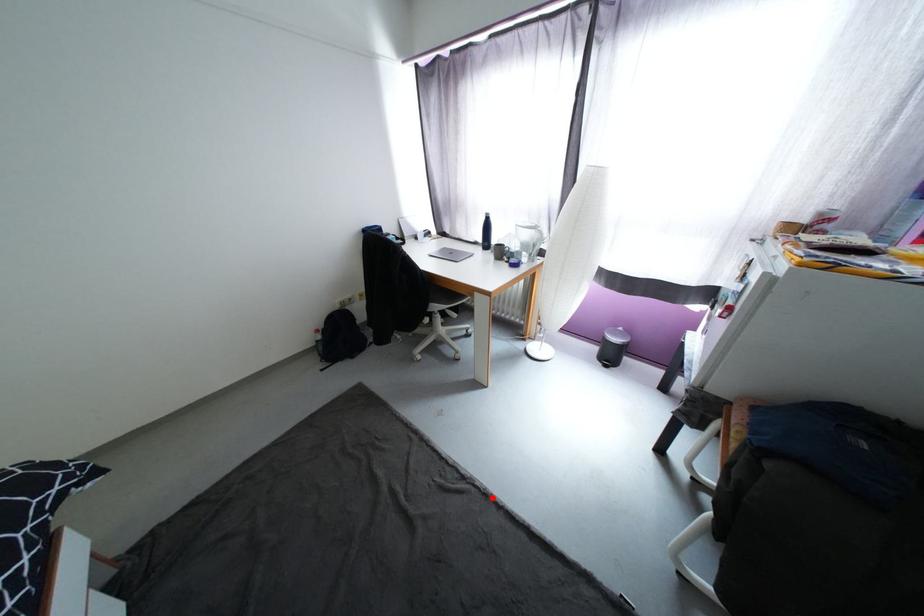
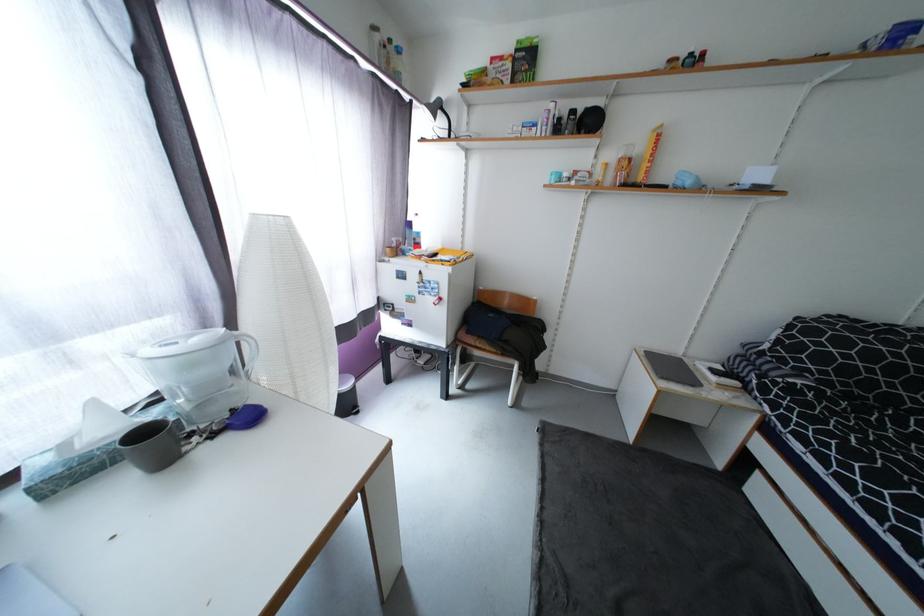
Question: I am providing you with two images of the same scene from different viewpoints. Image1 has a red point marked. In image2, the corresponding 3D location appears at what relative position? Reply with the corresponding letter.

Choices:
 (A) Closer
 (B) Farther

Answer: (B)